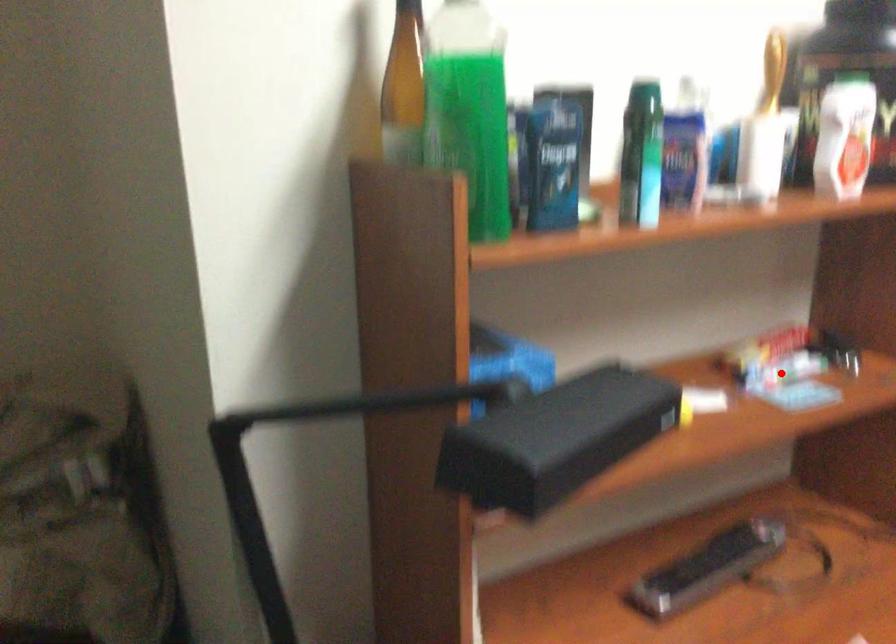
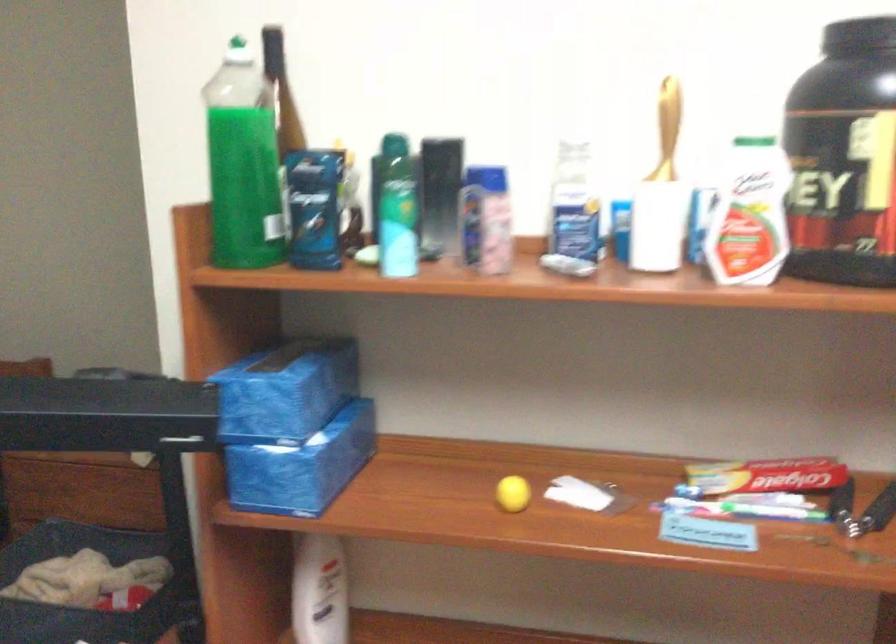
The point at the highlighted location is marked in the first image. Where is the corresponding point in the second image?

(743, 509)